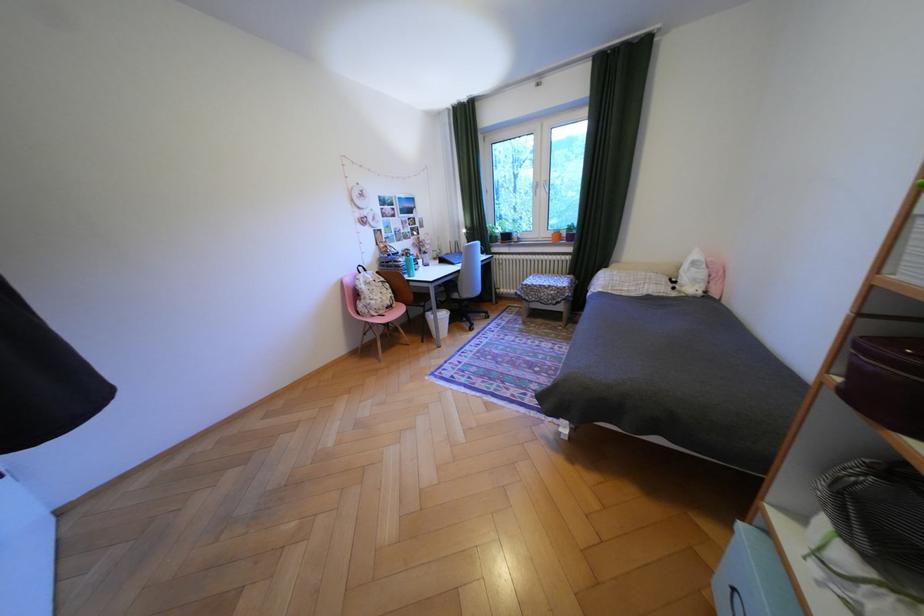
Which object does [691,275] point to?

This point indicates the striped pillow.